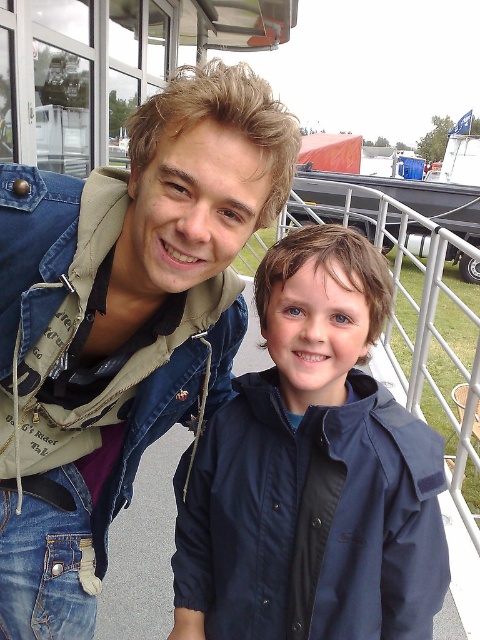
Is denim jacket at center above navy blue jacket at center?

Yes, denim jacket at center is above navy blue jacket at center.

Is point (236, 76) less distant than point (340, 417)?

Yes, point (236, 76) is closer to viewer.

What are the coordinates of `denim jacket at center` in the screenshot? It's located at (120, 324).

Locate an element on the screen. Image resolution: width=480 pixels, height=640 pixels. denim jacket at center is located at coordinates pos(120,324).